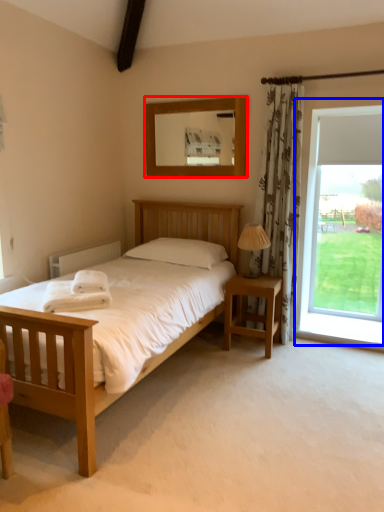
Question: Which object is closer to the camera taking this photo, mirror (highlighted by a red box) or window (highlighted by a blue box)?

Choices:
 (A) mirror
 (B) window

Answer: (A)